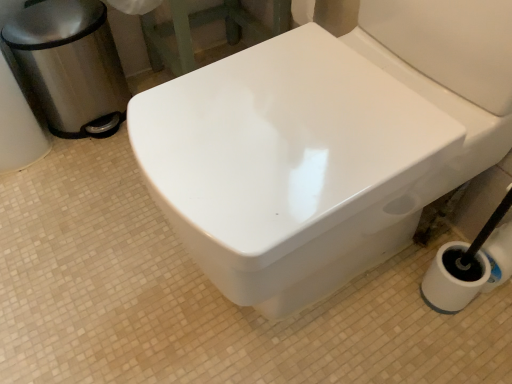
Question: Is polished stainless steel trash can at left bigger or smaller than white glossy bidet at center?

Choices:
 (A) big
 (B) small

Answer: (B)

Question: From a real-world perspective, relative to white glossy bidet at center, is polished stainless steel trash can at left vertically above or below?

Choices:
 (A) above
 (B) below

Answer: (B)

Question: Is point (50, 6) positioned closer to the camera than point (361, 140)?

Choices:
 (A) farther
 (B) closer

Answer: (A)

Question: Considering the positions of white glossy bidet at center and polished stainless steel trash can at left in the image, is white glossy bidet at center taller or shorter than polished stainless steel trash can at left?

Choices:
 (A) tall
 (B) short

Answer: (A)

Question: Does point (353, 125) appear closer or farther from the camera than point (51, 6)?

Choices:
 (A) farther
 (B) closer

Answer: (B)

Question: Based on their sizes in the image, would you say white glossy bidet at center is bigger or smaller than polished stainless steel trash can at left?

Choices:
 (A) small
 (B) big

Answer: (B)

Question: Considering the relative positions of white glossy bidet at center and polished stainless steel trash can at left in the image provided, is white glossy bidet at center to the left or to the right of polished stainless steel trash can at left?

Choices:
 (A) left
 (B) right

Answer: (B)